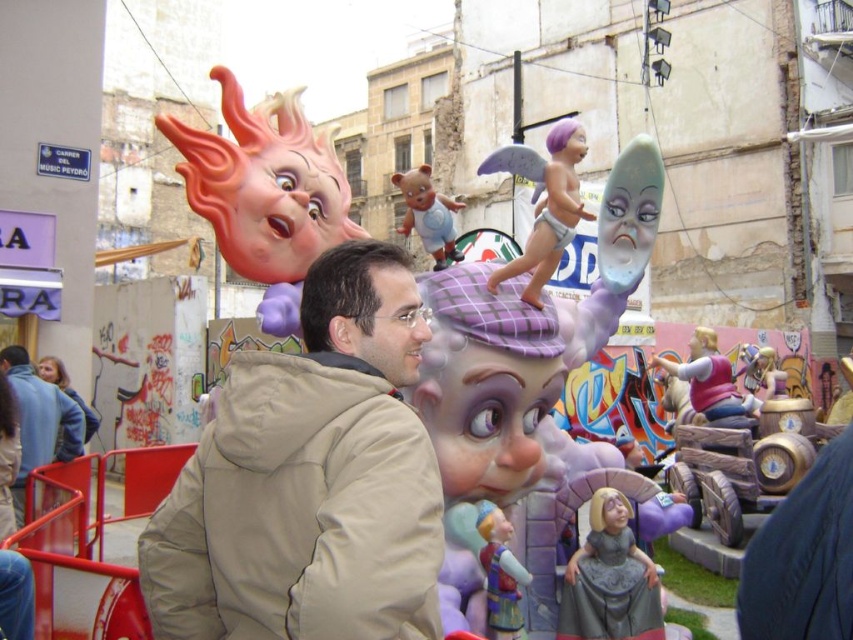
You are a photographer standing at the edge of the street. You want to take a photo that includes both the tan fabric jacket at center and the wooden horse at center. Which object should you focus on first to ensure both are in frame?

The tan fabric jacket at center is larger than the wooden horse at center, so focusing on the tan fabric jacket at center first will help ensure both are in frame.

You are a photographer trying to capture both the tan fabric jacket at center and the purple matte angel at center in a single frame. Given that your camera has a fixed focal length, which object should you position closer to the center of the frame to ensure both are fully visible?

Since the tan fabric jacket at center is narrower than the purple matte angel at center, you should position the tan fabric jacket at center closer to the center of the frame. This will allow the wider purple matte angel at center to occupy more space while keeping both within the frame.

Based on the photo, you are a photographer trying to capture both the tan fabric jacket at center and the purple matte angel at center in a single shot. Based on their positions, which object should you adjust your camera to focus on first to ensure both are in frame?

The tan fabric jacket at center is to the left of purple matte angel at center. To capture both in a single shot, focus on the purple matte angel at center first since it is further to the right, ensuring there is enough space to include the tan fabric jacket at center on the left side of the frame.